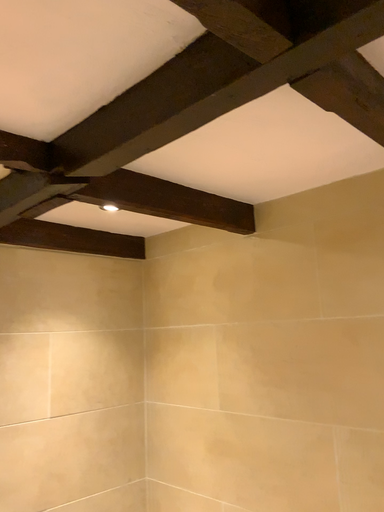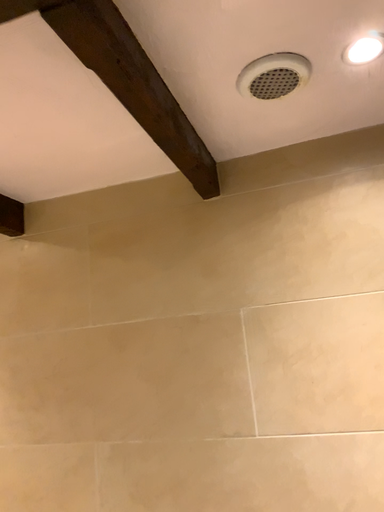
Question: How did the camera likely rotate when shooting the video?

Choices:
 (A) rotated left
 (B) rotated right

Answer: (B)